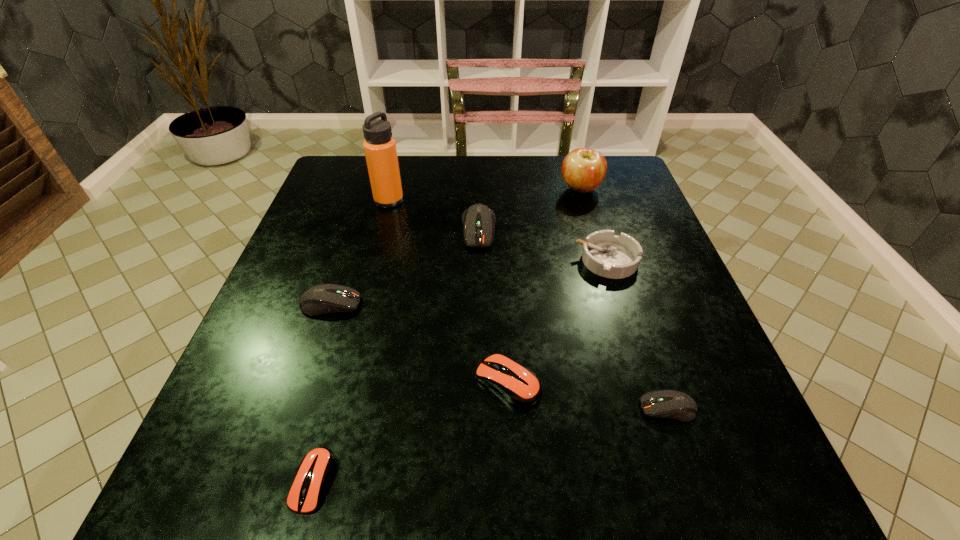
The width and height of the screenshot is (960, 540). I want to click on computer equipment that is positioned at the right edge, so click(673, 404).

You are a GUI agent. You are given a task and a screenshot of the screen. Output one action in this format:
    pyautogui.click(x=<x>, y=<y>)
    Task: Click on the object at the far left corner
    This screenshot has width=960, height=540.
    Given the screenshot: What is the action you would take?
    (380, 149)

At what (x,y) coordinates should I click in order to perform the action: click on object that is at the near left corner. Please return your answer as a coordinate pair (x, y). This screenshot has height=540, width=960. Looking at the image, I should click on pos(315,469).

I want to click on object located at the far right corner, so click(583, 170).

This screenshot has height=540, width=960. In the image, there is a desktop. Identify the location of blank space at the far edge. (473, 201).

Locate an element on the screen. The width and height of the screenshot is (960, 540). free space at the near edge of the desktop is located at coordinates (433, 492).

The height and width of the screenshot is (540, 960). Find the location of `vacant area at the left edge`. vacant area at the left edge is located at coordinates (324, 322).

This screenshot has width=960, height=540. In the image, there is a desktop. Find the location of `vacant space at the right edge`. vacant space at the right edge is located at coordinates (622, 205).

You are a GUI agent. You are given a task and a screenshot of the screen. Output one action in this format:
    pyautogui.click(x=<x>, y=<y>)
    Task: Click on the free spot at the far left corner of the desktop
    
    Given the screenshot: What is the action you would take?
    pyautogui.click(x=331, y=166)

Identify the location of vacant area at the far right corner. The width and height of the screenshot is (960, 540). (595, 198).